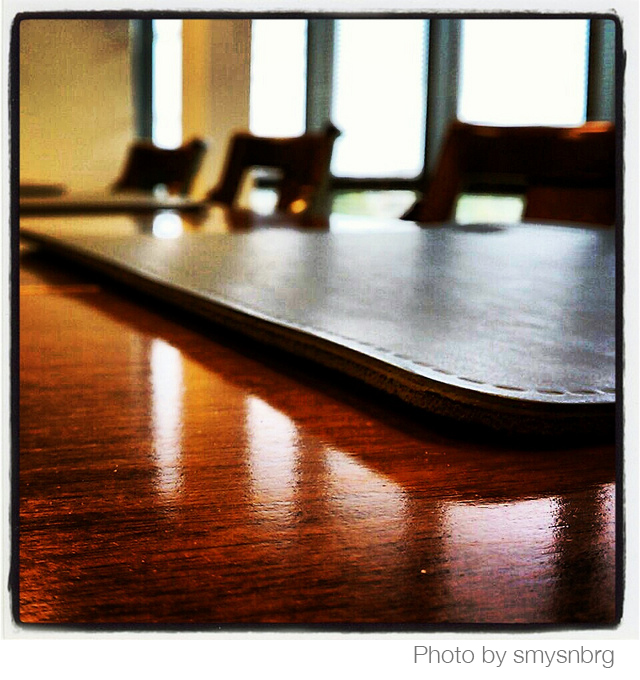
This screenshot has height=680, width=640. Find the location of `window frames`. window frames is located at coordinates (605, 77), (442, 79), (320, 81).